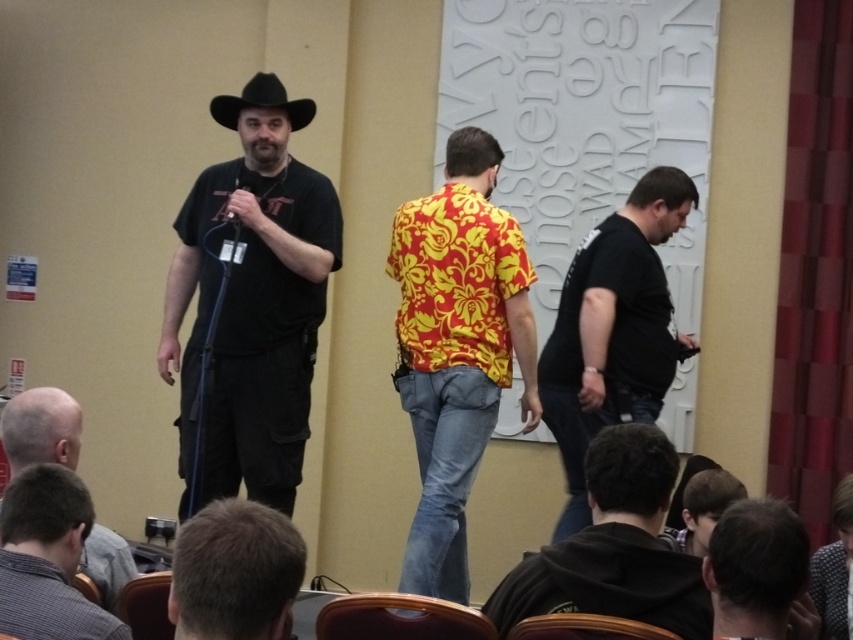
You are standing at the entrance of the conference room and see the point marked as point (399, 618). What object is located at that point?

The brown wooden chair at lower center is located at point (399, 618).

From the picture: You are an attendee sitting in the audience of the conference room. You notice two men on stage, one with short hair at lower left and another wearing a black felt cowboy hat at left. Which man is closer to you?

The short hair at lower left is in front of the black felt cowboy hat at left, so the man with short hair at lower left is closer to you.

You are standing at the center of the room and want to find the dark brown hair at lower right. Based on the coordinates provided, in which direction should you look to locate it?

The dark brown hair at lower right is located at coordinates point (759, 572), which corresponds to the lower right direction from your current position at the center of the room.